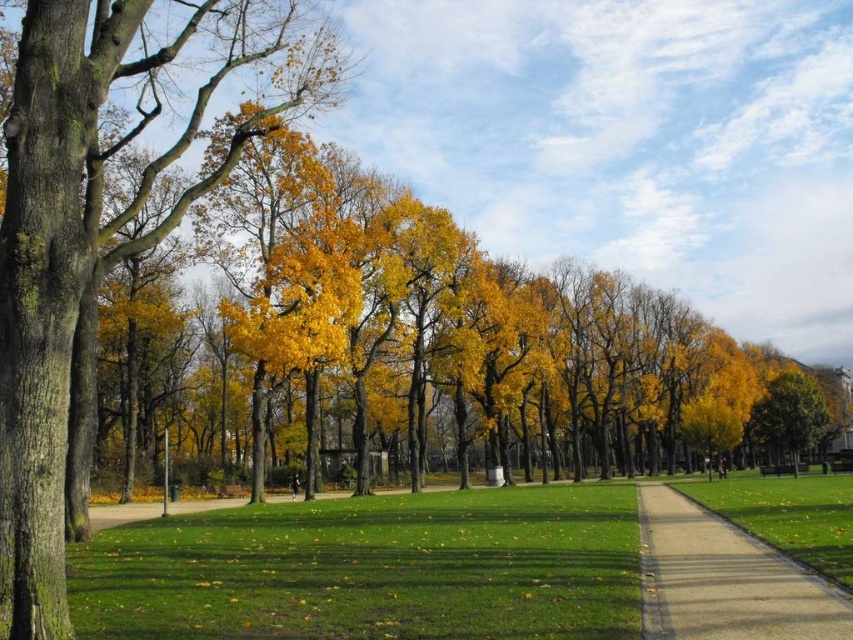
Is green grass at center to the left of smooth concrete path at center from the viewer's perspective?

Correct, you'll find green grass at center to the left of smooth concrete path at center.

Can you confirm if green grass at center is positioned above smooth concrete path at center?

No, green grass at center is not above smooth concrete path at center.

Find the location of a particular element. green grass at center is located at coordinates (x=370, y=570).

Consider the image. Is green grass at center behind golden yellow leaves at right?

No, it is in front of golden yellow leaves at right.

From the picture: Which is below, green grass at center or golden yellow leaves at right?

golden yellow leaves at right is below.

Find the location of `green grass at center`. green grass at center is located at coordinates [x=370, y=570].

This screenshot has height=640, width=853. What do you see at coordinates (103, 225) in the screenshot? I see `smooth bark tree at left` at bounding box center [103, 225].

Does smooth bark tree at left have a larger size compared to green grass at center?

Yes.

Which is behind, point (149, 225) or point (512, 589)?

The point (149, 225) is more distant.

The width and height of the screenshot is (853, 640). Find the location of `smooth bark tree at left`. smooth bark tree at left is located at coordinates (103, 225).